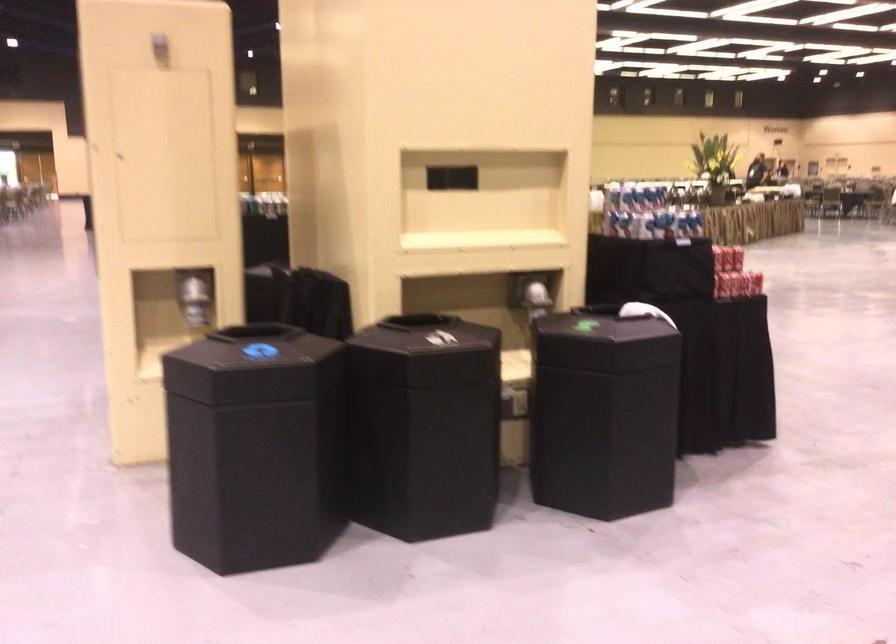
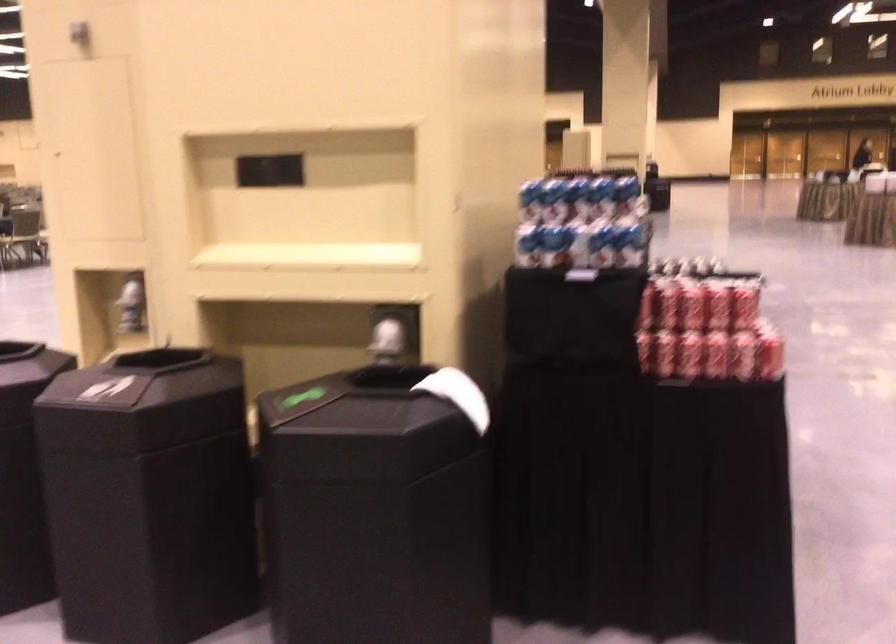
Locate, in the second image, the point that corresponds to pixel 683 221 in the first image.

(576, 247)